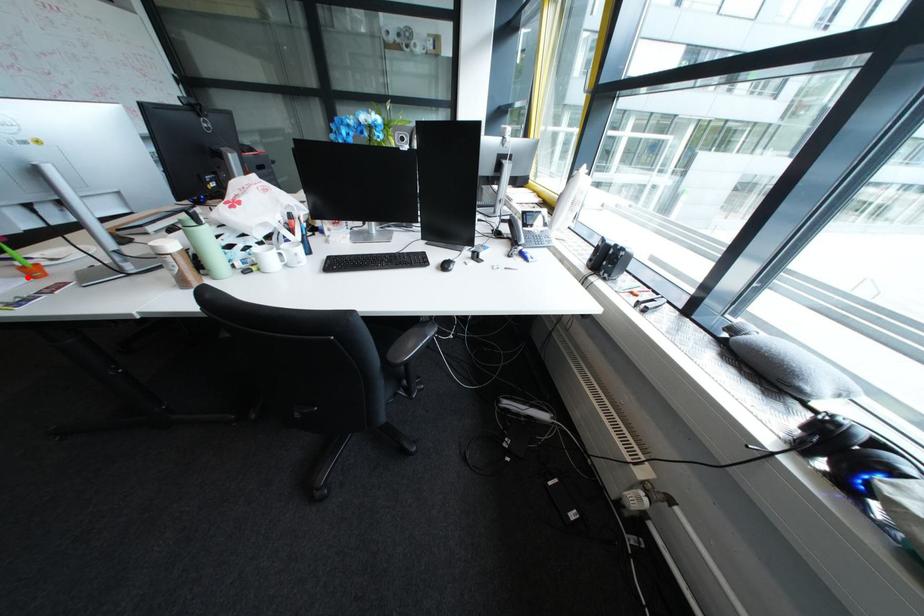
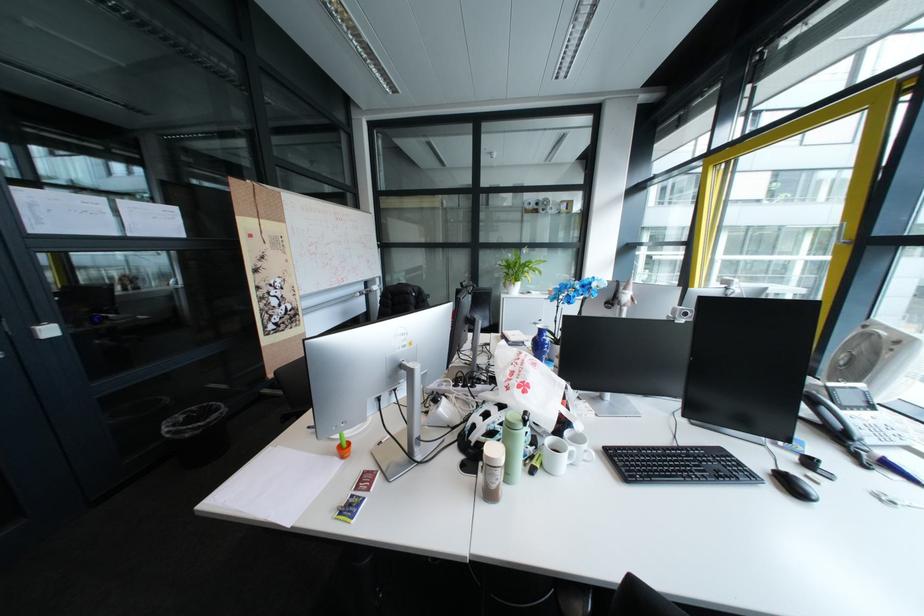
Locate, in the second image, the point that corresponds to the highlighted location in the first image.

(341, 454)